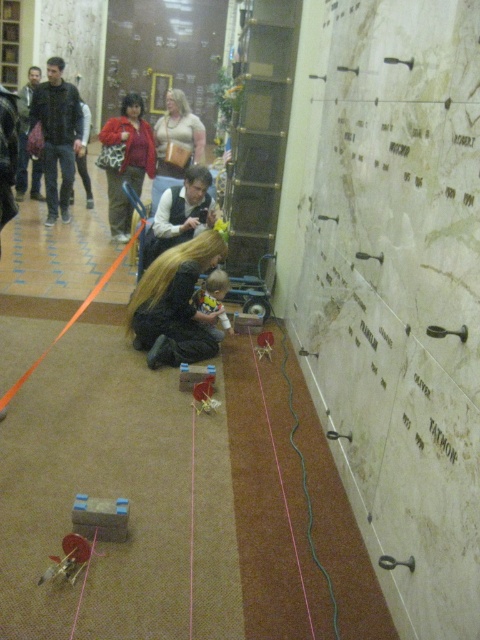
Question: Which object is the farthest from the matte red jacket at center?

Choices:
 (A) dark blue jeans at left
 (B) wooden plaque at upper center

Answer: (B)

Question: Among these points, which one is farthest from the camera?

Choices:
 (A) (188, 360)
 (B) (200, 172)
 (C) (194, 97)
 (D) (107, 157)

Answer: (C)

Question: Is wooden plaque at upper center behind matte black hair at center?

Choices:
 (A) no
 (B) yes

Answer: (B)

Question: Does matte red jacket at center appear under matte black hair at center?

Choices:
 (A) no
 (B) yes

Answer: (A)

Question: Is black matte dress at center below matte beige sweater at center?

Choices:
 (A) no
 (B) yes

Answer: (B)

Question: Which of the following is the farthest from the observer?

Choices:
 (A) matte beige sweater at center
 (B) dark blue jeans at left
 (C) black matte dress at center

Answer: (B)